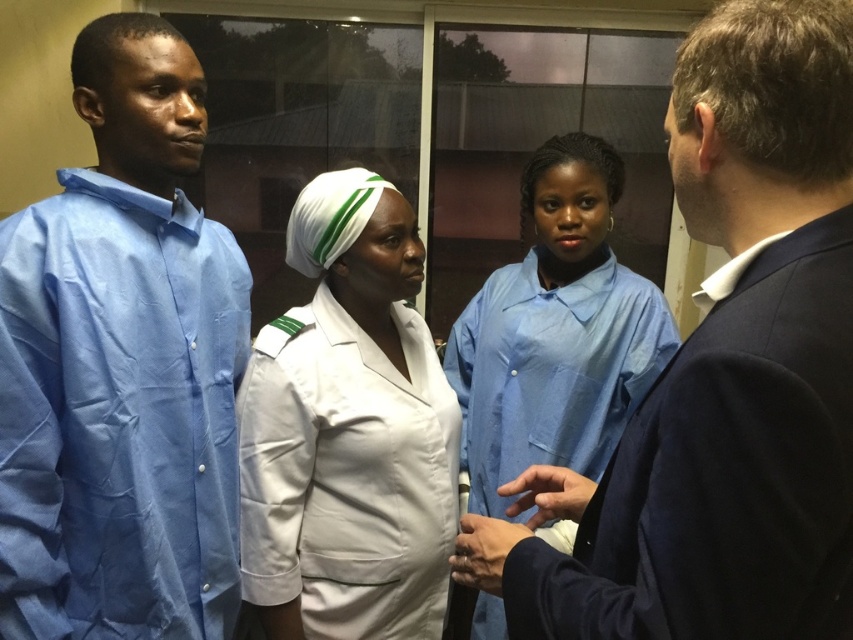
You are a security guard in the building and need to quickly identify who is closer to the entrance located at the front right of the scene. Which individual is closer to the entrance between the light blue fabric shirt at left and the white smooth uniform at center?

The light blue fabric shirt at left is closer to the entrance because it is positioned closer to the viewer than the white smooth uniform at center.

You are a photographer positioned at the back of the room. You want to take a clear photo of both the blue cotton uniform at right and the white smooth uniform at center. Which uniform should you focus on first to ensure both are in focus?

You should focus on the blue cotton uniform at right first because it is closer to the viewer than the white smooth uniform at center. By focusing on the closer object, the depth of field may allow the farther object to also be in focus.

From the picture: Based on the scene description, which object takes up more area in the image between the blue cotton uniform at right and the blue smooth uniform at center?

The blue smooth uniform at center occupies more space than the blue cotton uniform at right according to the description.